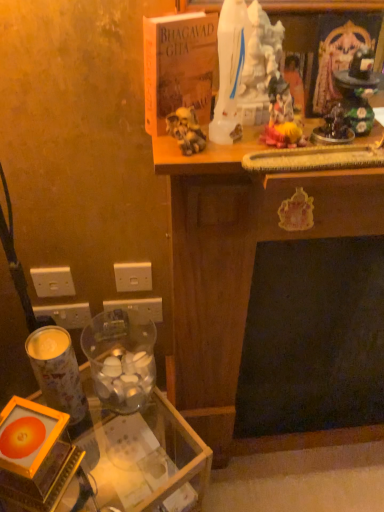
Question: Is white plastic electric outlet at lower left, the fourth electric outlet when ordered from right to left, far from metallic cylindrical candle holder at lower left, the second candle holder in the right-to-left sequence?

Choices:
 (A) yes
 (B) no

Answer: (B)

Question: Could you tell me if white plastic electric outlet at lower left, the fourth electric outlet when ordered from right to left, is turned towards metallic cylindrical candle holder at lower left, placed as the first candle holder when sorted from left to right?

Choices:
 (A) no
 (B) yes

Answer: (B)

Question: Does white plastic electric outlet at lower left, the fourth electric outlet when ordered from right to left, appear on the right side of metallic cylindrical candle holder at lower left, the second candle holder in the right-to-left sequence?

Choices:
 (A) yes
 (B) no

Answer: (B)

Question: From the image's perspective, would you say white plastic electric outlet at lower left, the fourth electric outlet when ordered from right to left, is positioned over metallic cylindrical candle holder at lower left, placed as the first candle holder when sorted from left to right?

Choices:
 (A) yes
 (B) no

Answer: (A)

Question: Is white plastic electric outlet at lower left, placed as the 1th electric outlet when sorted from left to right, smaller than metallic cylindrical candle holder at lower left, placed as the first candle holder when sorted from left to right?

Choices:
 (A) no
 (B) yes

Answer: (B)

Question: From the image's perspective, would you say white plastic electric outlet at lower left, placed as the 1th electric outlet when sorted from left to right, is shown under metallic cylindrical candle holder at lower left, the second candle holder in the right-to-left sequence?

Choices:
 (A) no
 (B) yes

Answer: (A)

Question: Is the surface of transparent glass table at lower left in direct contact with transparent glass candle holder at lower left, arranged as the second candle holder when viewed from the left?

Choices:
 (A) yes
 (B) no

Answer: (B)

Question: Does transparent glass table at lower left have a greater height compared to transparent glass candle holder at lower left, arranged as the second candle holder when viewed from the left?

Choices:
 (A) no
 (B) yes

Answer: (B)

Question: Does transparent glass table at lower left come in front of transparent glass candle holder at lower left, arranged as the second candle holder when viewed from the left?

Choices:
 (A) no
 (B) yes

Answer: (B)

Question: Could you tell me if transparent glass table at lower left is facing transparent glass candle holder at lower left, the first candle holder from the right?

Choices:
 (A) no
 (B) yes

Answer: (A)

Question: Is transparent glass table at lower left at the right side of transparent glass candle holder at lower left, arranged as the second candle holder when viewed from the left?

Choices:
 (A) no
 (B) yes

Answer: (A)

Question: Can you confirm if transparent glass table at lower left is shorter than transparent glass candle holder at lower left, arranged as the second candle holder when viewed from the left?

Choices:
 (A) no
 (B) yes

Answer: (A)

Question: Does hardcover bhagavad gita at upper center touch metallic cylindrical candle holder at lower left, the second candle holder in the right-to-left sequence?

Choices:
 (A) yes
 (B) no

Answer: (B)